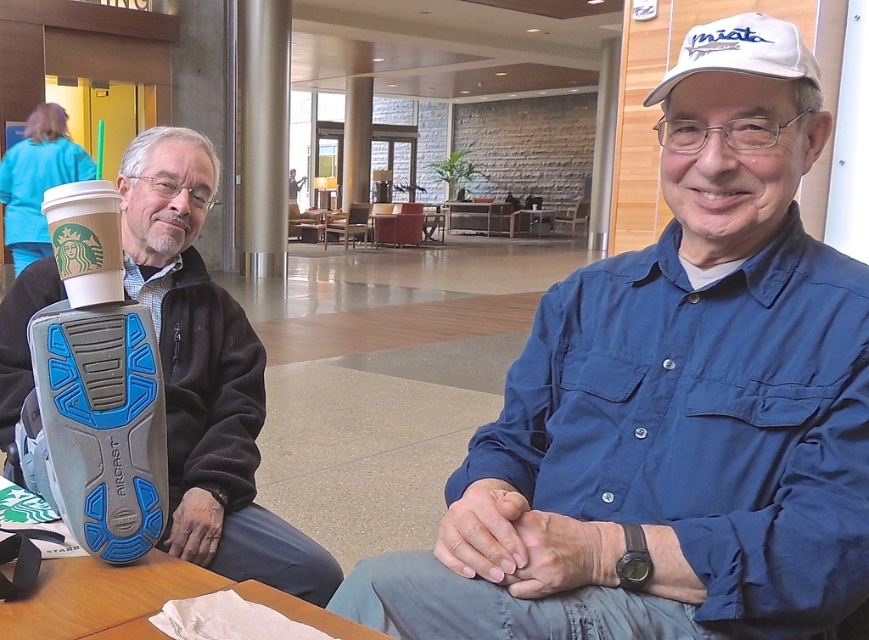
You are a photographer adjusting your camera to focus on the white paper cup at upper left. However, the matte black shoe at left is blocking your view. Can you move the shoe to get a clear shot of the cup?

The matte black shoe at left is further to the viewer than the white paper cup at upper left, so moving the shoe away from you would allow you to see the cup.

You are a photographer setting up for a group photo. You need to ensure that the matte black shoe at left and the white fabric baseball cap at upper right are both visible in the frame. Based on their sizes, which object might require more space in the composition?

The matte black shoe at left might require more space in the composition since it is wider than the white fabric baseball cap at upper right.

You are standing at the entrance of the lobby and want to place a new potted plant at the same location as the matte black shoe at left. What coordinates should you use?

You should place the potted plant at coordinates point (x=206, y=376) where the matte black shoe at left is located.